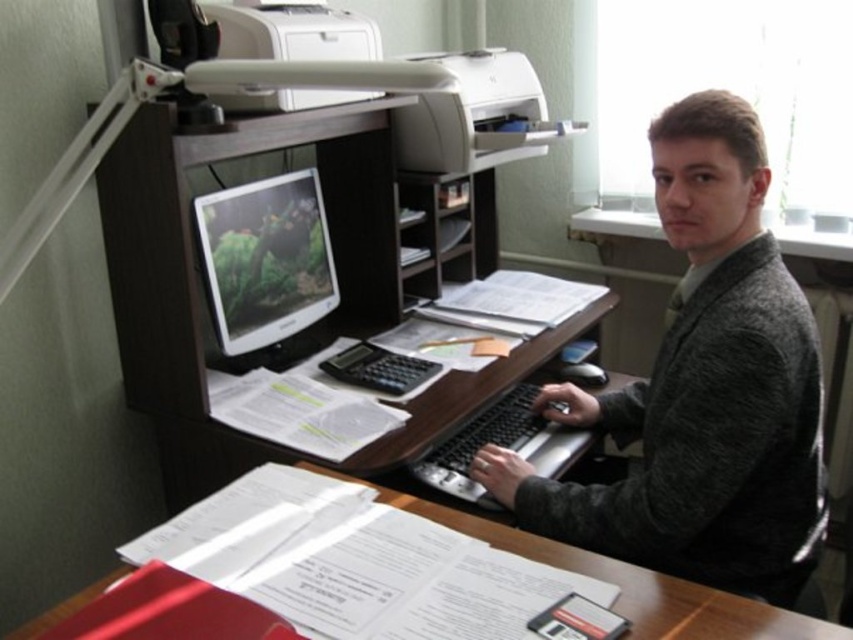
Question: Can you confirm if gray wool sweater at center is bigger than white plastic printer at upper center?

Choices:
 (A) yes
 (B) no

Answer: (A)

Question: Can you confirm if dark wood computer desk at center is smaller than white matte printer at upper center?

Choices:
 (A) yes
 (B) no

Answer: (B)

Question: Among these points, which one is farthest from the camera?

Choices:
 (A) pyautogui.click(x=738, y=611)
 (B) pyautogui.click(x=492, y=154)

Answer: (B)

Question: Does white plastic printer at upper center appear over white matte printer at upper center?

Choices:
 (A) yes
 (B) no

Answer: (A)

Question: Which point is closer to the camera?

Choices:
 (A) gray wool sweater at center
 (B) wooden desk at center

Answer: (B)

Question: Which point is farther to the camera?

Choices:
 (A) (489, 436)
 (B) (511, 93)
 (C) (173, 144)
 (D) (254, 33)

Answer: (B)